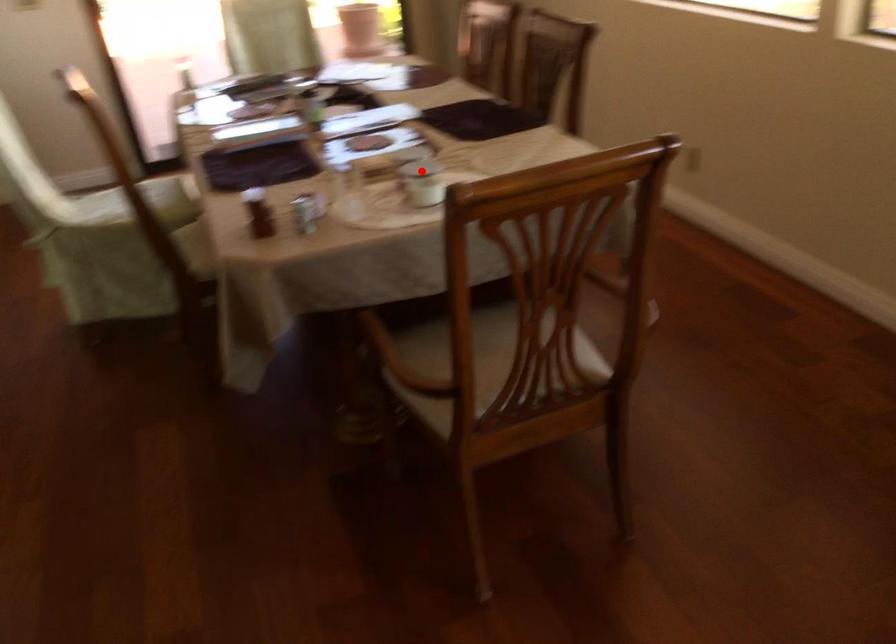
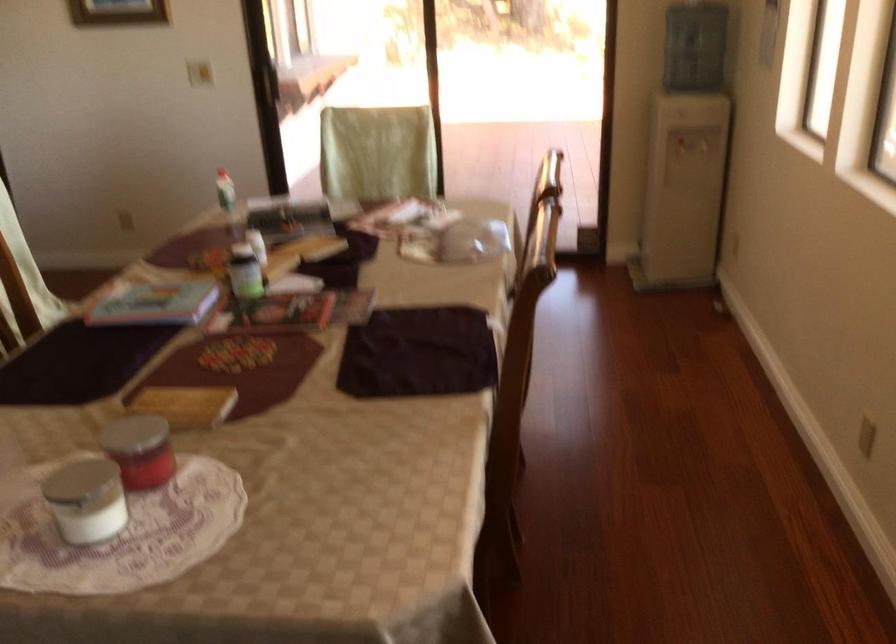
Question: I am providing you with two images of the same scene from different viewpoints. Image1 has a red point marked. In image2, the corresponding 3D location appears at what relative position? Reply with the corresponding letter.

Choices:
 (A) Closer
 (B) Farther

Answer: (A)